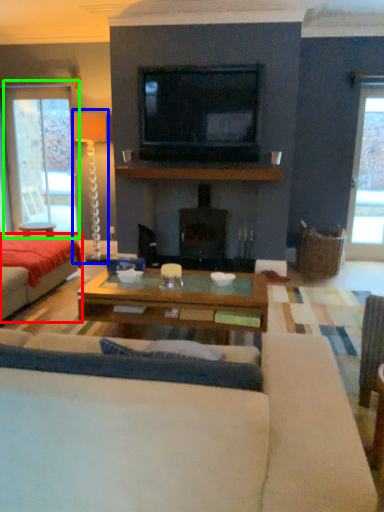
Question: Which is farther away from bed (highlighted by a red box)? lamp (highlighted by a blue box) or window (highlighted by a green box)?

Choices:
 (A) lamp
 (B) window

Answer: (A)